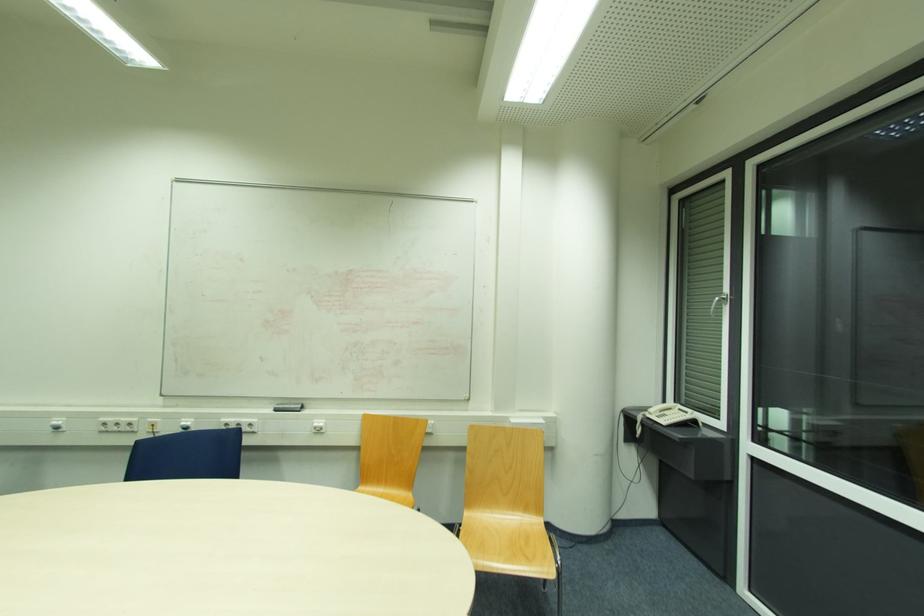
You are a GUI agent. You are given a task and a screenshot of the screen. Output one action in this format:
    pyautogui.click(x=<x>, y=<y>)
    Task: Click on the wooden chair sitting surface
    
    Given the screenshot: What is the action you would take?
    pyautogui.click(x=516, y=545)